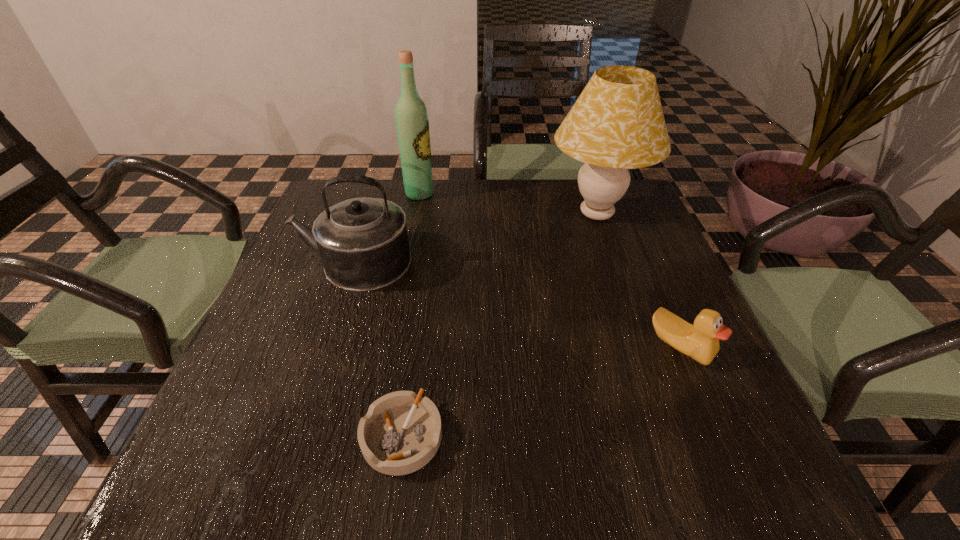
The width and height of the screenshot is (960, 540). I want to click on free space located on the back of the nearest object, so (x=417, y=335).

Where is `wine bottle at the far edge`? wine bottle at the far edge is located at coordinates (412, 123).

Locate an element on the screen. The height and width of the screenshot is (540, 960). lampshade at the far edge is located at coordinates (617, 123).

Identify the location of object that is at the near edge. This screenshot has height=540, width=960. (401, 432).

Find the location of `object at the left edge`. object at the left edge is located at coordinates (363, 243).

Image resolution: width=960 pixels, height=540 pixels. I want to click on lampshade that is at the right edge, so click(x=617, y=123).

Locate an element on the screen. The width and height of the screenshot is (960, 540). duck situated at the right edge is located at coordinates (700, 342).

Where is `object that is at the far right corner`? object that is at the far right corner is located at coordinates (617, 123).

Where is `free space at the far edge of the desktop`? The width and height of the screenshot is (960, 540). free space at the far edge of the desktop is located at coordinates (381, 194).

You are a GUI agent. You are given a task and a screenshot of the screen. Output one action in this format:
    pyautogui.click(x=<x>, y=<y>)
    Task: Click on the vacant space at the near edge of the desktop
    This screenshot has height=540, width=960.
    Given the screenshot: What is the action you would take?
    pyautogui.click(x=547, y=483)